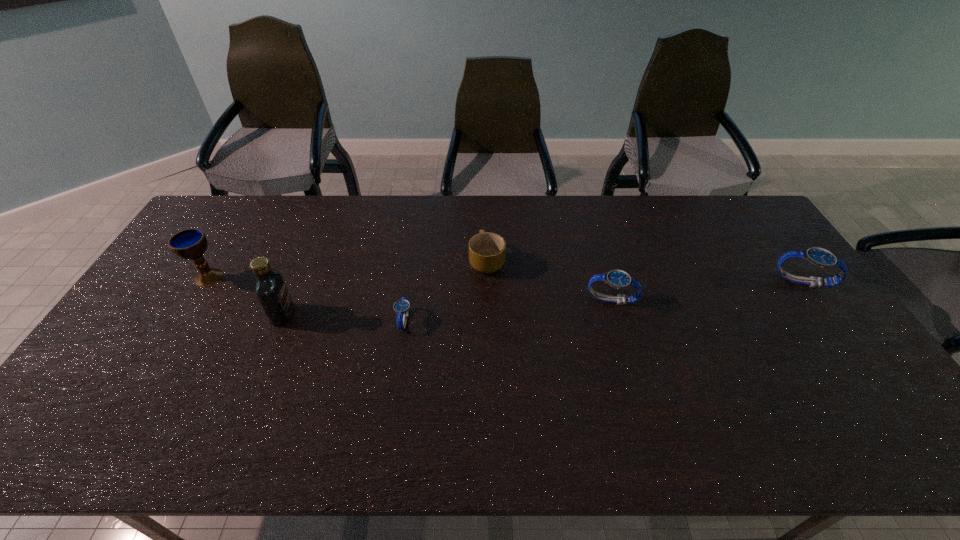
You are a GUI agent. You are given a task and a screenshot of the screen. Output one action in this format:
    pyautogui.click(x=<x>, y=<y>)
    Task: Click on the free space located on the left of the shortest watch
    This screenshot has height=540, width=960.
    Given the screenshot: What is the action you would take?
    pyautogui.click(x=340, y=320)

Identify the location of vacant area located on the back of the second object from right to left. Image resolution: width=960 pixels, height=540 pixels. (587, 212).

The height and width of the screenshot is (540, 960). I want to click on vacant area situated 0.160m on the front of the rightmost watch, so click(x=841, y=335).

Find the location of a particular element. free point located on the side with the handle of the third object from right to left is located at coordinates (487, 225).

Where is `free space located on the side with the handle of the third object from right to left`? This screenshot has height=540, width=960. free space located on the side with the handle of the third object from right to left is located at coordinates (487, 228).

This screenshot has width=960, height=540. In order to click on vacant space located on the side with the handle of the third object from right to left in this screenshot , I will do `click(487, 232)`.

This screenshot has width=960, height=540. In order to click on free space located on the right of the second tallest object in this screenshot , I will do `click(247, 277)`.

Locate an element on the screen. vacant space located 0.380m on the front-facing side of the tallest object is located at coordinates (425, 315).

Where is `object located at the left edge`? This screenshot has width=960, height=540. object located at the left edge is located at coordinates (191, 243).

Identify the location of object that is at the right edge. The width and height of the screenshot is (960, 540). (820, 257).